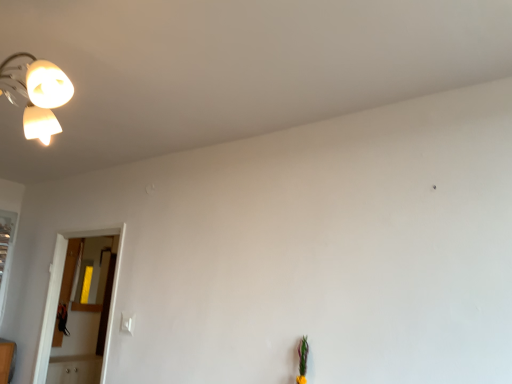
Where is `transparent glass door at lower left`? transparent glass door at lower left is located at coordinates (79, 352).

What is the approximate height of transparent glass door at lower left?

4.03 feet.

Describe the element at coordinates (79, 352) in the screenshot. Image resolution: width=512 pixels, height=384 pixels. I see `transparent glass door at lower left` at that location.

Locate an element on the screen. transparent glass door at lower left is located at coordinates (79, 352).